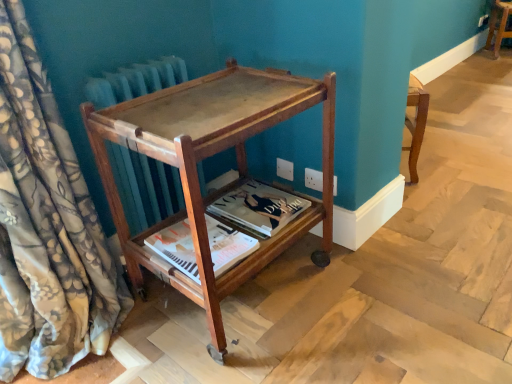
Question: From a real-world perspective, is matte paper magazine at center, which is counted as the 1th magazine, starting from the front, on top of floral silk curtain at left?

Choices:
 (A) yes
 (B) no

Answer: (B)

Question: From a real-world perspective, is matte paper magazine at center, which is the 2th magazine from back to front, physically below floral silk curtain at left?

Choices:
 (A) no
 (B) yes

Answer: (B)

Question: Does matte paper magazine at center, which is the 2th magazine from back to front, touch floral silk curtain at left?

Choices:
 (A) yes
 (B) no

Answer: (B)

Question: Is matte paper magazine at center, which is counted as the 1th magazine, starting from the front, at the left side of floral silk curtain at left?

Choices:
 (A) yes
 (B) no

Answer: (B)

Question: Can floral silk curtain at left be found inside matte paper magazine at center, which is counted as the 1th magazine, starting from the front?

Choices:
 (A) yes
 (B) no

Answer: (B)

Question: Considering the positions of floral silk curtain at left and wooden stool at center, marked as the second furniture in a bottom-to-top arrangement, in the image, is floral silk curtain at left wider or thinner than wooden stool at center, marked as the second furniture in a bottom-to-top arrangement,?

Choices:
 (A) wide
 (B) thin

Answer: (A)

Question: Considering the positions of floral silk curtain at left and wooden stool at center, placed as the first furniture when sorted from top to bottom, in the image, is floral silk curtain at left taller or shorter than wooden stool at center, placed as the first furniture when sorted from top to bottom,?

Choices:
 (A) short
 (B) tall

Answer: (B)

Question: From a real-world perspective, is floral silk curtain at left positioned above or below wooden stool at center, the 2th furniture from the front?

Choices:
 (A) below
 (B) above

Answer: (B)

Question: Is point (9, 367) positioned closer to the camera than point (509, 8)?

Choices:
 (A) closer
 (B) farther

Answer: (A)

Question: Relative to floral silk curtain at left, is matte paper magazine at center, which is the 1th magazine from back to front, in front or behind?

Choices:
 (A) behind
 (B) front

Answer: (A)

Question: Is point (250, 185) positioned closer to the camera than point (83, 198)?

Choices:
 (A) closer
 (B) farther

Answer: (B)

Question: Considering the positions of matte paper magazine at center, positioned as the 2th magazine in front-to-back order, and floral silk curtain at left in the image, is matte paper magazine at center, positioned as the 2th magazine in front-to-back order, bigger or smaller than floral silk curtain at left?

Choices:
 (A) small
 (B) big

Answer: (A)

Question: Based on their positions, is matte paper magazine at center, positioned as the 2th magazine in front-to-back order, located to the left or right of floral silk curtain at left?

Choices:
 (A) left
 (B) right

Answer: (B)

Question: Considering the positions of matte paper magazine at center, which is the 2th magazine from back to front, and mahogany wood side table at center, arranged as the 2th furniture when viewed from the top, in the image, is matte paper magazine at center, which is the 2th magazine from back to front, wider or thinner than mahogany wood side table at center, arranged as the 2th furniture when viewed from the top,?

Choices:
 (A) wide
 (B) thin

Answer: (B)

Question: Would you say matte paper magazine at center, which is the 2th magazine from back to front, is inside or outside mahogany wood side table at center, the 2th furniture positioned from the back?

Choices:
 (A) inside
 (B) outside

Answer: (A)